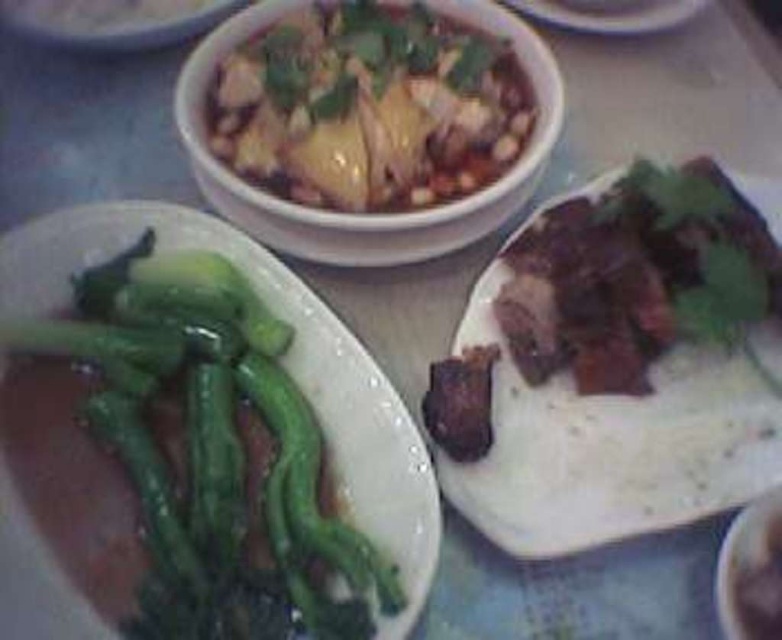
Is brown crispy meat at center bigger than white ceramic plate at upper center?

Yes.

Who is more distant from viewer, (479, 424) or (705, 3)?

Point (705, 3)

Find the location of a particular element. brown crispy meat at center is located at coordinates tap(461, 403).

Does white glossy chicken at upper center have a lesser height compared to brown crispy meat at center?

In fact, white glossy chicken at upper center may be taller than brown crispy meat at center.

This screenshot has height=640, width=782. Find the location of `white glossy chicken at upper center`. white glossy chicken at upper center is located at coordinates (368, 108).

Describe the element at coordinates (368, 108) in the screenshot. The width and height of the screenshot is (782, 640). I see `white glossy chicken at upper center` at that location.

Locate an element on the screen. This screenshot has height=640, width=782. white glossy chicken at upper center is located at coordinates (368, 108).

Which is more to the right, white glossy chicken at upper center or white ceramic plate at upper center?

Positioned to the right is white ceramic plate at upper center.

The height and width of the screenshot is (640, 782). Describe the element at coordinates (368, 108) in the screenshot. I see `white glossy chicken at upper center` at that location.

This screenshot has height=640, width=782. Find the location of `white glossy chicken at upper center`. white glossy chicken at upper center is located at coordinates (368, 108).